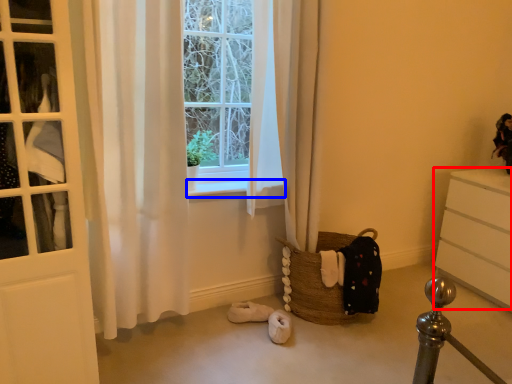
Question: Which object appears closest to the camera in this image, chest of drawers (highlighted by a red box) or window sill (highlighted by a blue box)?

Choices:
 (A) chest of drawers
 (B) window sill

Answer: (B)